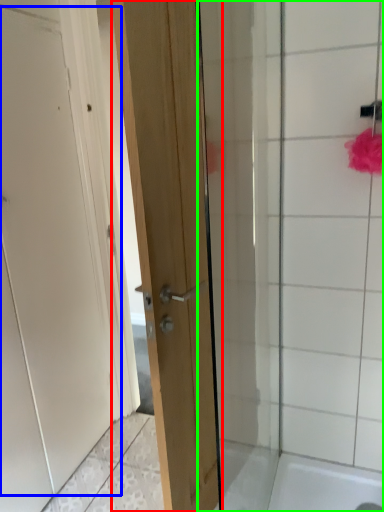
Question: Estimate the real-world distances between objects in this image. Which object is farther from door (highlighted by a red box), door (highlighted by a blue box) or shower door (highlighted by a green box)?

Choices:
 (A) door
 (B) shower door

Answer: (A)